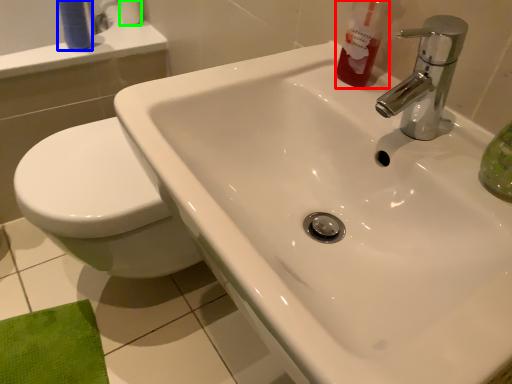
Question: Based on their relative distances, which object is farther from cleaning product (highlighted by a red box)? Choose from toiletry (highlighted by a blue box) and toilet paper (highlighted by a green box).

Choices:
 (A) toiletry
 (B) toilet paper

Answer: (B)